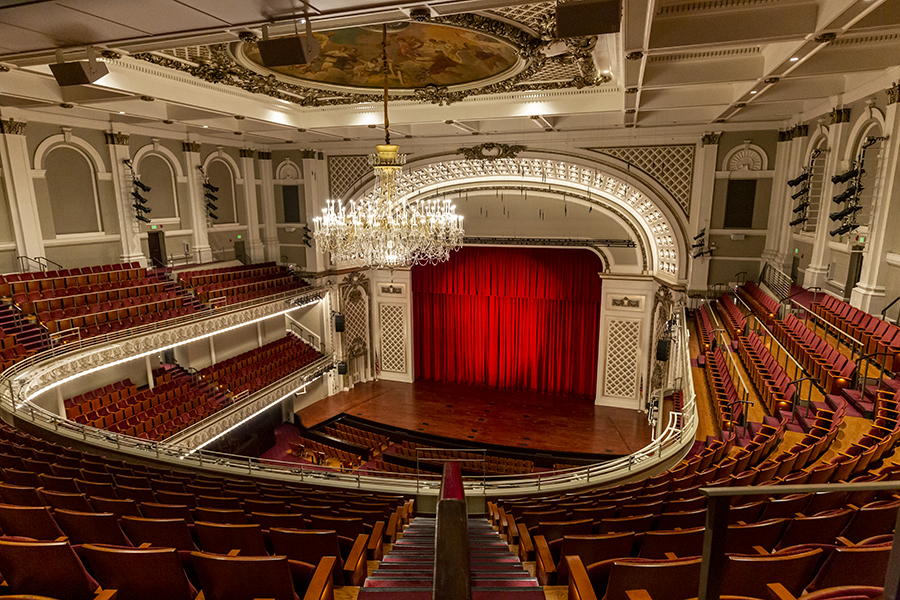
Where is `painting`? painting is located at coordinates (445, 48).